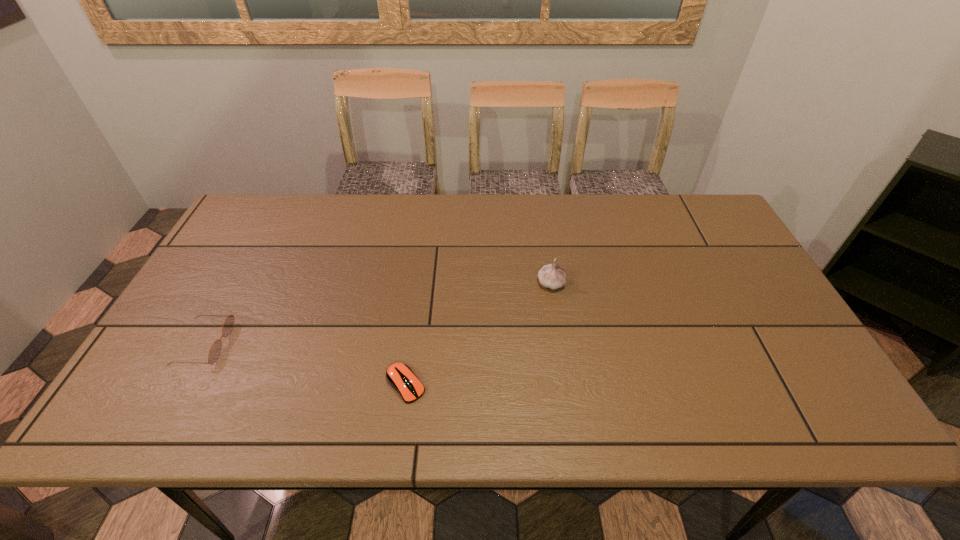
Where is `vacant region between the tallest object and the second tallest object`? vacant region between the tallest object and the second tallest object is located at coordinates (377, 313).

I want to click on free area in between the second shortest object and the tallest object, so click(377, 313).

Identify the location of vacant space that is in between the leftmost object and the tallest object. The width and height of the screenshot is (960, 540). (377, 313).

In order to click on vacant region between the second shortest object and the shortest object in this screenshot , I will do [x=305, y=364].

Where is `empty space between the second tallest object and the tallest object`? Image resolution: width=960 pixels, height=540 pixels. empty space between the second tallest object and the tallest object is located at coordinates (377, 313).

This screenshot has width=960, height=540. I want to click on vacant space that's between the tallest object and the computer mouse, so click(x=478, y=334).

I want to click on free space between the garlic and the computer mouse, so click(478, 334).

Where is `object that is the closest to the second object from right to left`? object that is the closest to the second object from right to left is located at coordinates click(552, 276).

The height and width of the screenshot is (540, 960). I want to click on the closest object to the second tallest object, so click(399, 375).

You are a GUI agent. You are given a task and a screenshot of the screen. Output one action in this format:
    pyautogui.click(x=<x>, y=<y>)
    Task: Click on the vacant region that satisfies the following two spatial constraints: 1. on the face of the second tallest object; 2. on the right side of the second object from left to right
    Image resolution: width=960 pixels, height=540 pixels.
    Given the screenshot: What is the action you would take?
    pyautogui.click(x=182, y=384)